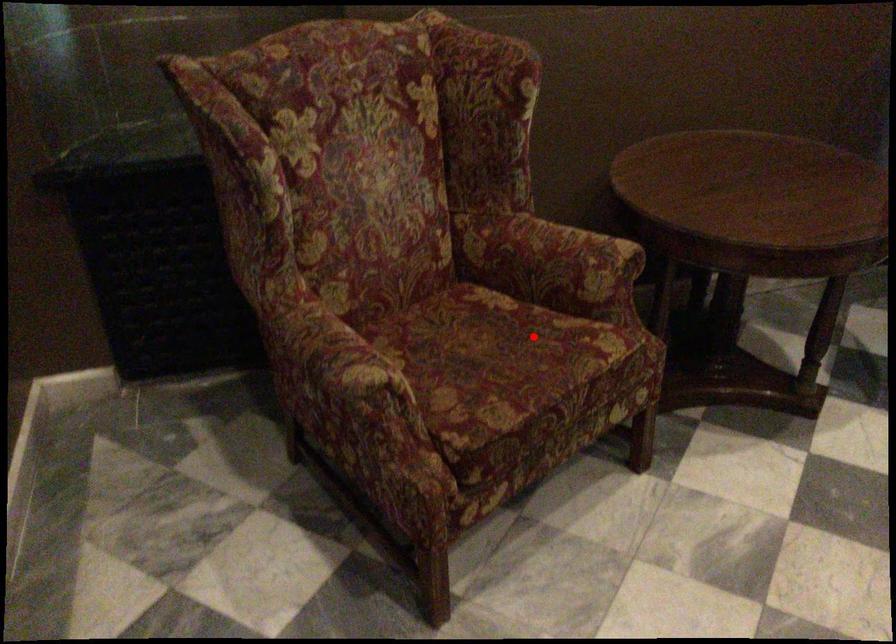
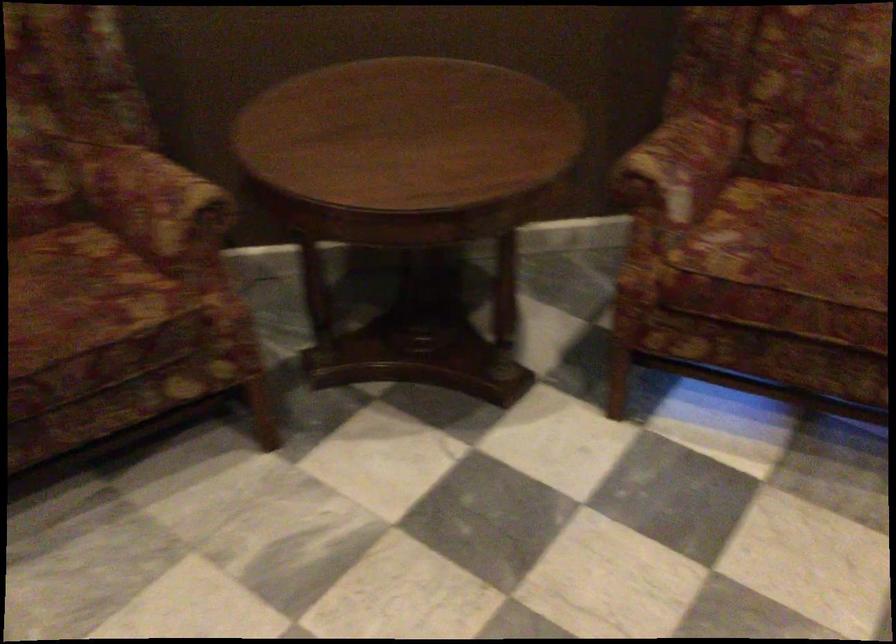
In the second image, find the point that corresponds to the highlighted location in the first image.

(80, 292)